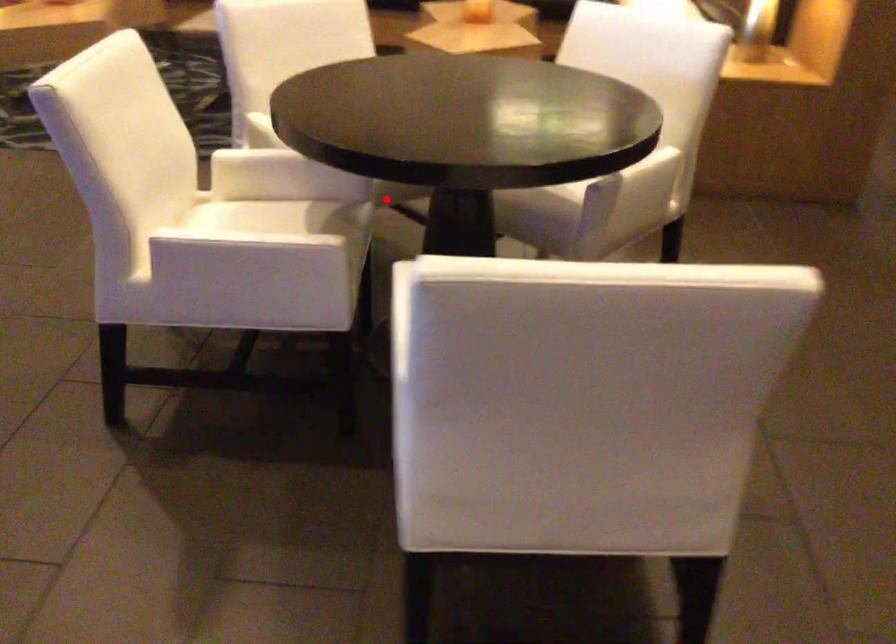
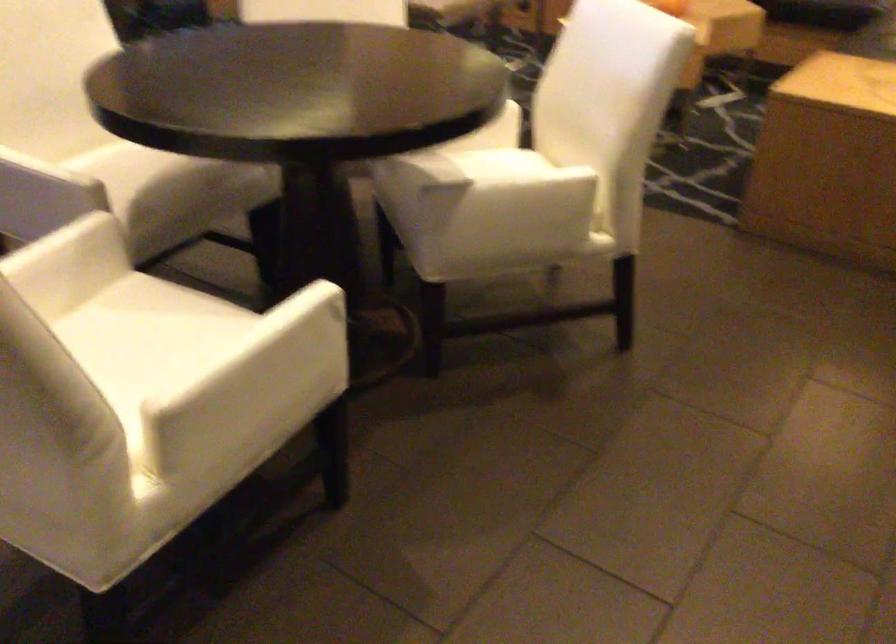
Question: I am providing you with two images of the same scene from different viewpoints. A red point is marked on the first image. Is the red point's position out of view in image 2?

Choices:
 (A) Yes
 (B) No

Answer: (A)